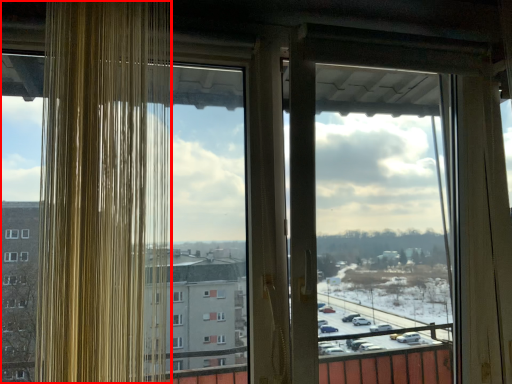
Question: From the image, what is the correct spatial relationship of window (annotated by the red box) in relation to screen door?

Choices:
 (A) right
 (B) left

Answer: (B)